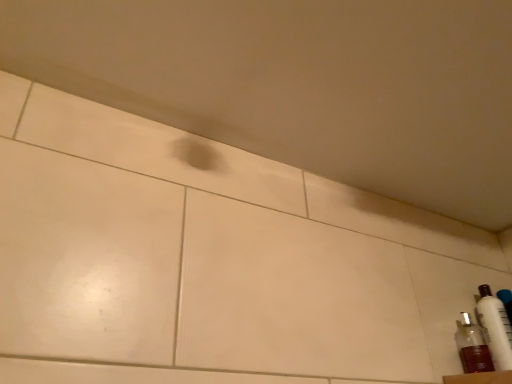
Locate an element on the screen. translucent plastic bottle at lower right, which is counted as the first bottle, starting from the left is located at coordinates (472, 347).

What do you see at coordinates (472, 347) in the screenshot? Image resolution: width=512 pixels, height=384 pixels. I see `translucent plastic bottle at lower right, the 2th bottle viewed from the right` at bounding box center [472, 347].

The height and width of the screenshot is (384, 512). Describe the element at coordinates (495, 328) in the screenshot. I see `white glossy bottle at lower right, which ranks as the first bottle in right-to-left order` at that location.

The image size is (512, 384). What are the coordinates of `white glossy bottle at lower right, placed as the 2th bottle when sorted from left to right` in the screenshot? It's located at [495, 328].

Locate an element on the screen. translucent plastic bottle at lower right, which is counted as the first bottle, starting from the left is located at coordinates (472, 347).

Considering the positions of objects translucent plastic bottle at lower right, the 2th bottle viewed from the right, and white glossy bottle at lower right, placed as the 2th bottle when sorted from left to right, in the image provided, who is more to the left, translucent plastic bottle at lower right, the 2th bottle viewed from the right, or white glossy bottle at lower right, placed as the 2th bottle when sorted from left to right,?

Positioned to the left is translucent plastic bottle at lower right, the 2th bottle viewed from the right.

In the image, is translucent plastic bottle at lower right, which is counted as the first bottle, starting from the left, positioned in front of or behind white glossy bottle at lower right, which ranks as the first bottle in right-to-left order?

In the image, translucent plastic bottle at lower right, which is counted as the first bottle, starting from the left, appears in front of white glossy bottle at lower right, which ranks as the first bottle in right-to-left order.

Between point (466, 327) and point (498, 299), which one is positioned behind?

Point (498, 299)

From the image's perspective, is translucent plastic bottle at lower right, the 2th bottle viewed from the right, above white glossy bottle at lower right, which ranks as the first bottle in right-to-left order?

Actually, translucent plastic bottle at lower right, the 2th bottle viewed from the right, appears below white glossy bottle at lower right, which ranks as the first bottle in right-to-left order, in the image.

From a real-world perspective, is translucent plastic bottle at lower right, which is counted as the first bottle, starting from the left, positioned above or below white glossy bottle at lower right, which ranks as the first bottle in right-to-left order?

translucent plastic bottle at lower right, which is counted as the first bottle, starting from the left, is situated lower than white glossy bottle at lower right, which ranks as the first bottle in right-to-left order, in the real world.

Based on the photo, can you confirm if translucent plastic bottle at lower right, which is counted as the first bottle, starting from the left, is thinner than white glossy bottle at lower right, placed as the 2th bottle when sorted from left to right?

No.

Is translucent plastic bottle at lower right, the 2th bottle viewed from the right, shorter than white glossy bottle at lower right, placed as the 2th bottle when sorted from left to right?

Yes.

Between translucent plastic bottle at lower right, which is counted as the first bottle, starting from the left, and white glossy bottle at lower right, placed as the 2th bottle when sorted from left to right, which one has smaller size?

white glossy bottle at lower right, placed as the 2th bottle when sorted from left to right.

Is translucent plastic bottle at lower right, the 2th bottle viewed from the right, not within white glossy bottle at lower right, which ranks as the first bottle in right-to-left order?

Yes.

Is translucent plastic bottle at lower right, the 2th bottle viewed from the right, next to white glossy bottle at lower right, placed as the 2th bottle when sorted from left to right, and touching it?

Absolutely, translucent plastic bottle at lower right, the 2th bottle viewed from the right, is next to and touching white glossy bottle at lower right, placed as the 2th bottle when sorted from left to right.

Is translucent plastic bottle at lower right, the 2th bottle viewed from the right, oriented away from white glossy bottle at lower right, placed as the 2th bottle when sorted from left to right?

No, translucent plastic bottle at lower right, the 2th bottle viewed from the right, is not facing the opposite direction of white glossy bottle at lower right, placed as the 2th bottle when sorted from left to right.

Locate an element on the screen. bottle to the left of white glossy bottle at lower right, which ranks as the first bottle in right-to-left order is located at coordinates (472, 347).

Is white glossy bottle at lower right, placed as the 2th bottle when sorted from left to right, to the left or to the right of translucent plastic bottle at lower right, which is counted as the first bottle, starting from the left, in the image?

Based on their positions, white glossy bottle at lower right, placed as the 2th bottle when sorted from left to right, is located to the right of translucent plastic bottle at lower right, which is counted as the first bottle, starting from the left.

Is white glossy bottle at lower right, which ranks as the first bottle in right-to-left order, behind translucent plastic bottle at lower right, the 2th bottle viewed from the right?

Yes, it is behind translucent plastic bottle at lower right, the 2th bottle viewed from the right.

Is point (483, 293) closer to camera compared to point (463, 360)?

No.

From the image's perspective, does white glossy bottle at lower right, which ranks as the first bottle in right-to-left order, appear lower than translucent plastic bottle at lower right, the 2th bottle viewed from the right?

No, from the image's perspective, white glossy bottle at lower right, which ranks as the first bottle in right-to-left order, is not below translucent plastic bottle at lower right, the 2th bottle viewed from the right.

From a real-world perspective, is white glossy bottle at lower right, placed as the 2th bottle when sorted from left to right, positioned above or below translucent plastic bottle at lower right, the 2th bottle viewed from the right?

From a real-world perspective, white glossy bottle at lower right, placed as the 2th bottle when sorted from left to right, is physically above translucent plastic bottle at lower right, the 2th bottle viewed from the right.

Does white glossy bottle at lower right, which ranks as the first bottle in right-to-left order, have a lesser width compared to translucent plastic bottle at lower right, the 2th bottle viewed from the right?

Indeed, white glossy bottle at lower right, which ranks as the first bottle in right-to-left order, has a lesser width compared to translucent plastic bottle at lower right, the 2th bottle viewed from the right.

In the scene shown: Which of these two, white glossy bottle at lower right, which ranks as the first bottle in right-to-left order, or translucent plastic bottle at lower right, which is counted as the first bottle, starting from the left, stands shorter?

With less height is translucent plastic bottle at lower right, which is counted as the first bottle, starting from the left.

Which of these two, white glossy bottle at lower right, placed as the 2th bottle when sorted from left to right, or translucent plastic bottle at lower right, the 2th bottle viewed from the right, is smaller?

Smaller between the two is white glossy bottle at lower right, placed as the 2th bottle when sorted from left to right.

Would you say translucent plastic bottle at lower right, which is counted as the first bottle, starting from the left, is part of white glossy bottle at lower right, placed as the 2th bottle when sorted from left to right,'s contents?

No, white glossy bottle at lower right, placed as the 2th bottle when sorted from left to right, does not contain translucent plastic bottle at lower right, which is counted as the first bottle, starting from the left.

Is white glossy bottle at lower right, which ranks as the first bottle in right-to-left order, next to translucent plastic bottle at lower right, the 2th bottle viewed from the right, and touching it?

Yes, white glossy bottle at lower right, which ranks as the first bottle in right-to-left order, is in contact with translucent plastic bottle at lower right, the 2th bottle viewed from the right.

Is white glossy bottle at lower right, which ranks as the first bottle in right-to-left order, facing away from translucent plastic bottle at lower right, the 2th bottle viewed from the right?

white glossy bottle at lower right, which ranks as the first bottle in right-to-left order, does not have its back to translucent plastic bottle at lower right, the 2th bottle viewed from the right.

How many degrees apart are the facing directions of white glossy bottle at lower right, placed as the 2th bottle when sorted from left to right, and translucent plastic bottle at lower right, which is counted as the first bottle, starting from the left?

The angular difference between white glossy bottle at lower right, placed as the 2th bottle when sorted from left to right, and translucent plastic bottle at lower right, which is counted as the first bottle, starting from the left, is 16.1 degrees.

This screenshot has height=384, width=512. In order to click on bottle on the right of the translucent plastic bottle at lower right, the 2th bottle viewed from the right in this screenshot , I will do `click(495, 328)`.

Locate an element on the screen. The image size is (512, 384). bottle on the left of white glossy bottle at lower right, which ranks as the first bottle in right-to-left order is located at coordinates (472, 347).

Find the location of `bottle below the white glossy bottle at lower right, placed as the 2th bottle when sorted from left to right (from a real-world perspective)`. bottle below the white glossy bottle at lower right, placed as the 2th bottle when sorted from left to right (from a real-world perspective) is located at coordinates (472, 347).